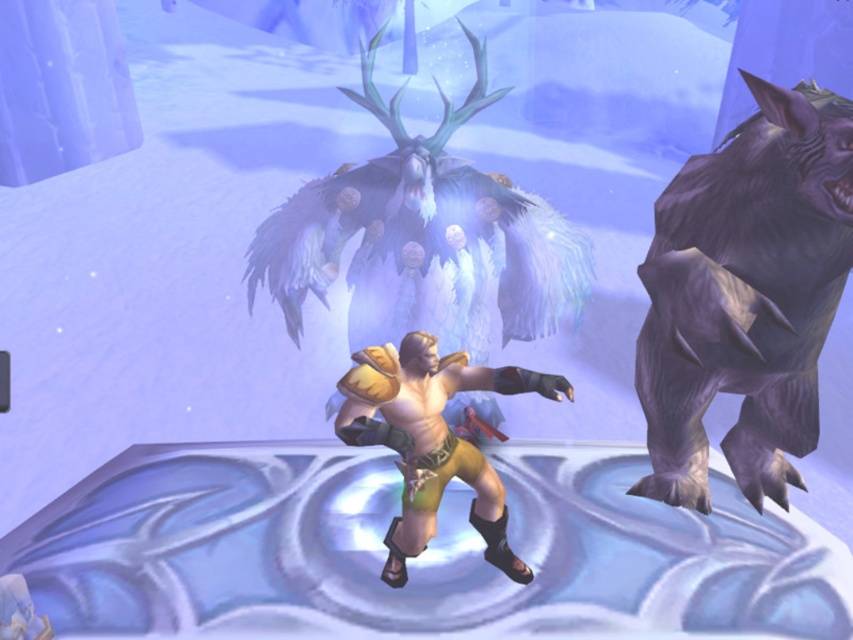
Question: Considering the relative positions of gray furry bear at right and golden leather armor at center in the image provided, where is gray furry bear at right located with respect to golden leather armor at center?

Choices:
 (A) left
 (B) right

Answer: (B)

Question: Where is gray furry bear at right located in relation to golden leather armor at center in the image?

Choices:
 (A) above
 (B) below

Answer: (A)

Question: From the image, what is the correct spatial relationship of gray furry bear at right in relation to golden leather armor at center?

Choices:
 (A) left
 (B) right

Answer: (B)